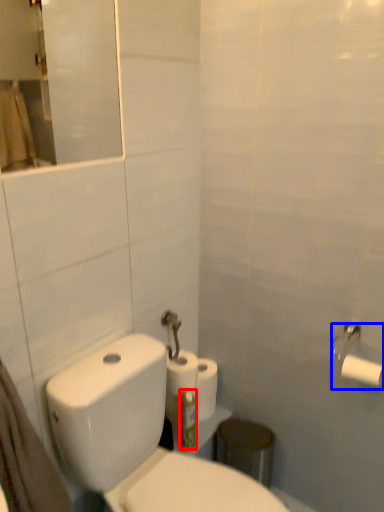
Question: Among these objects, which one is nearest to the camera, toothbrush (highlighted by a red box) or toilet paper (highlighted by a blue box)?

Choices:
 (A) toothbrush
 (B) toilet paper

Answer: (B)